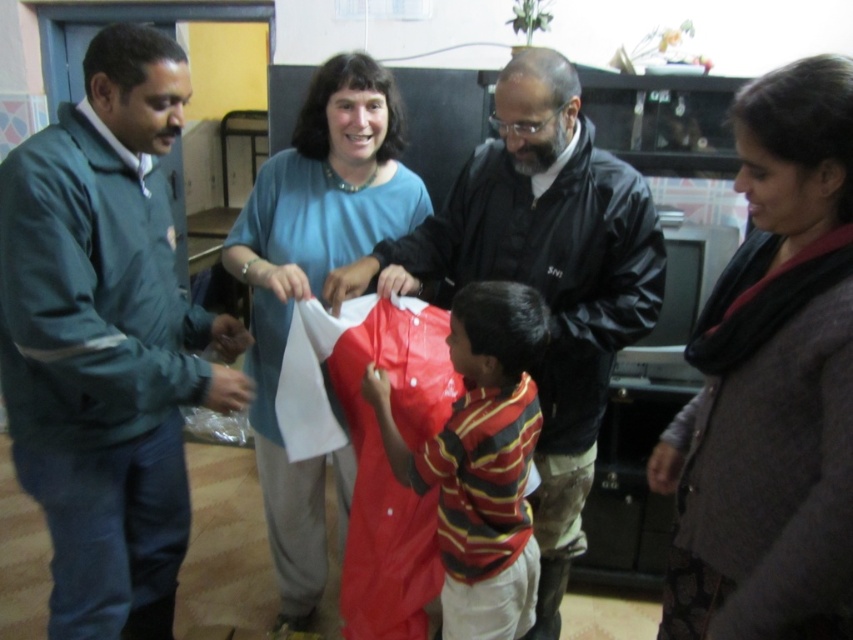
Question: Which object is farther from the camera taking this photo?

Choices:
 (A) dark gray sweater at center
 (B) black leather jacket at center
 (C) green fabric jacket at left
 (D) blue matte shirt at center

Answer: (D)

Question: Which of these objects is positioned farthest from the black leather jacket at center?

Choices:
 (A) green fabric jacket at left
 (B) dark gray sweater at center
 (C) blue matte shirt at center
 (D) red shiny shirt at center

Answer: (A)

Question: Observing the image, what is the correct spatial positioning of dark gray sweater at center in reference to red shiny shirt at center?

Choices:
 (A) right
 (B) left

Answer: (A)

Question: Considering the real-world distances, which object is farthest from the dark gray sweater at center?

Choices:
 (A) black leather jacket at center
 (B) blue matte shirt at center

Answer: (B)

Question: Can you confirm if green fabric jacket at left is positioned above blue matte shirt at center?

Choices:
 (A) yes
 (B) no

Answer: (B)

Question: Can you confirm if blue matte shirt at center is positioned to the right of red shiny shirt at center?

Choices:
 (A) no
 (B) yes

Answer: (A)